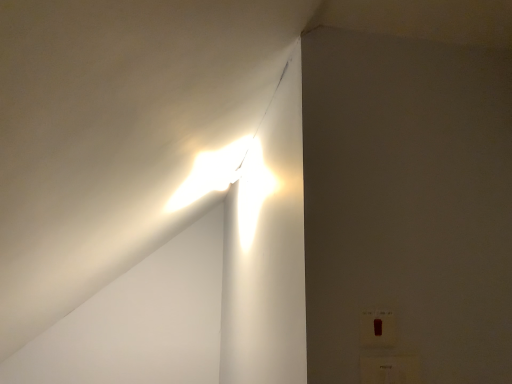
Question: Is white plastic electric outlet at lower right, which is the first electric outlet from bottom to top, situated inside matte white switch at lower right, arranged as the 1th electric outlet when viewed from the top, or outside?

Choices:
 (A) outside
 (B) inside

Answer: (A)

Question: In terms of size, does white plastic electric outlet at lower right, which appears as the 2th electric outlet when viewed from the top, appear bigger or smaller than matte white switch at lower right, placed as the second electric outlet when sorted from bottom to top?

Choices:
 (A) big
 (B) small

Answer: (A)

Question: Is white plastic electric outlet at lower right, which appears as the 2th electric outlet when viewed from the top, taller or shorter than matte white switch at lower right, arranged as the 1th electric outlet when viewed from the top?

Choices:
 (A) tall
 (B) short

Answer: (A)

Question: In terms of height, does matte white switch at lower right, arranged as the 1th electric outlet when viewed from the top, look taller or shorter compared to white plastic electric outlet at lower right, which appears as the 2th electric outlet when viewed from the top?

Choices:
 (A) short
 (B) tall

Answer: (A)

Question: Would you say matte white switch at lower right, placed as the second electric outlet when sorted from bottom to top, is inside or outside white plastic electric outlet at lower right, which appears as the 2th electric outlet when viewed from the top?

Choices:
 (A) inside
 (B) outside

Answer: (B)

Question: From a real-world perspective, relative to white plastic electric outlet at lower right, which is the first electric outlet from bottom to top, is matte white switch at lower right, placed as the second electric outlet when sorted from bottom to top, vertically above or below?

Choices:
 (A) above
 (B) below

Answer: (A)

Question: Is matte white switch at lower right, placed as the second electric outlet when sorted from bottom to top, in front of or behind white plastic electric outlet at lower right, which appears as the 2th electric outlet when viewed from the top, in the image?

Choices:
 (A) front
 (B) behind

Answer: (B)